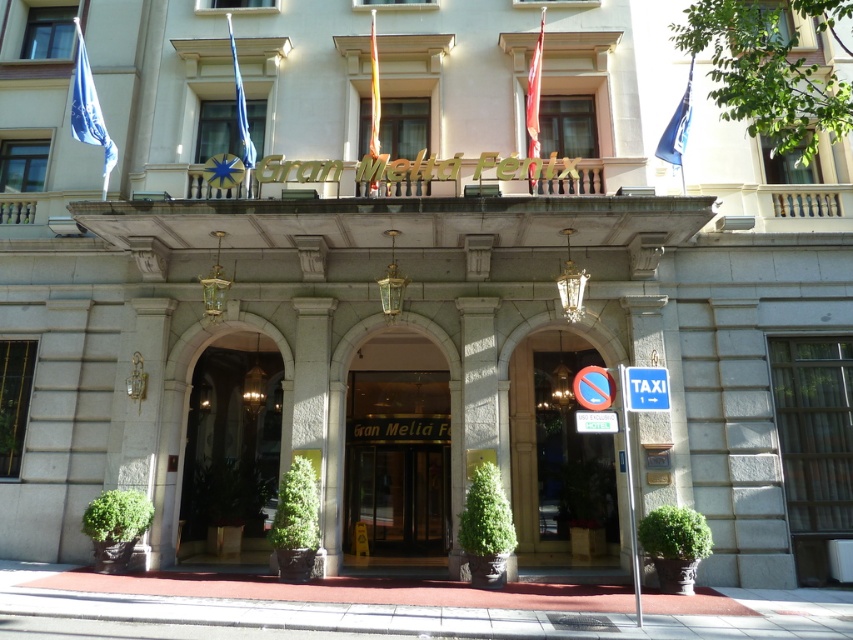
You are standing at the entrance of the Gran Meli? Fenix hotel and want to take a photo of both the blue fabric flag at upper right and the metallic circular sign at right. Which object should you position closer to the camera to ensure both are visible in the frame?

You should position the blue fabric flag at upper right closer to the camera because the metallic circular sign at right is behind it, so moving the flag forward will allow both to be visible.

You are a hotel guest standing at the entrance of the Gran Meli? Fenix hotel. You notice two flags flying above the entrance. The red fabric flag at center and the blue fabric flag at upper center. Which flag is narrower?

The red fabric flag at center is narrower than the blue fabric flag at upper center.

You are a delivery person with a 5 meter long box. You need to move the box through the entrance of the Gran Meli? Fenix hotel. Can you fit the box between the green stone archway at center and the smooth stone pillar at center?

The distance between the green stone archway at center and the smooth stone pillar at center is 5.11 meters. Since the box is 5 meters long, it will fit with 11 centimeters to spare.